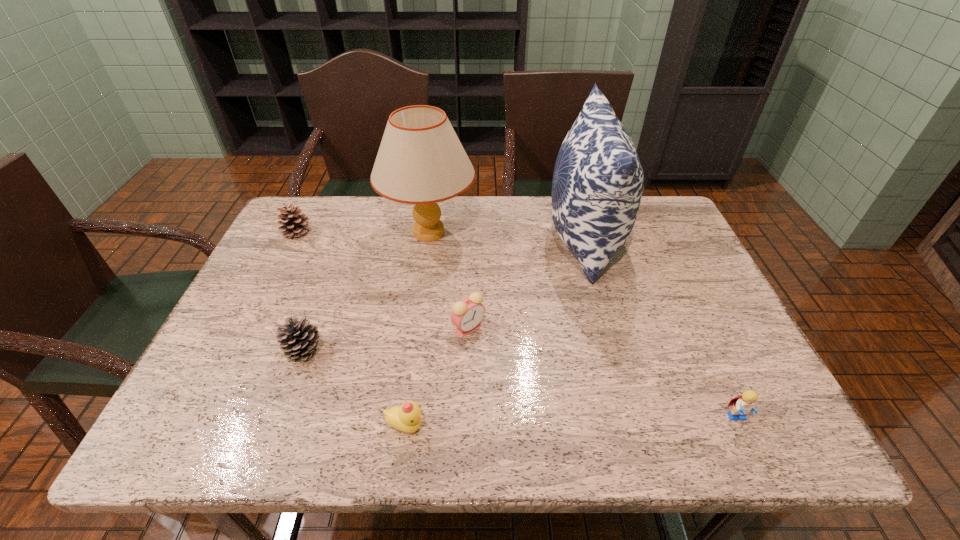
Select which object appears as the sixth closest to the second object from left to right. Please provide its 2D coordinates. Your answer should be formatted as a tuple, i.e. [(x, y)], where the tuple contains the x and y coordinates of a point satisfying the conditions above.

[(743, 404)]

In order to click on free location that satisfies the following two spatial constraints: 1. on the front side of the left pinecone; 2. on the left side of the nearer pinecone in this screenshot , I will do `click(238, 349)`.

The width and height of the screenshot is (960, 540). What are the coordinates of `vacant space that satisfies the following two spatial constraints: 1. on the back side of the lampshade; 2. on the left side of the second object from left to right` in the screenshot? It's located at (347, 233).